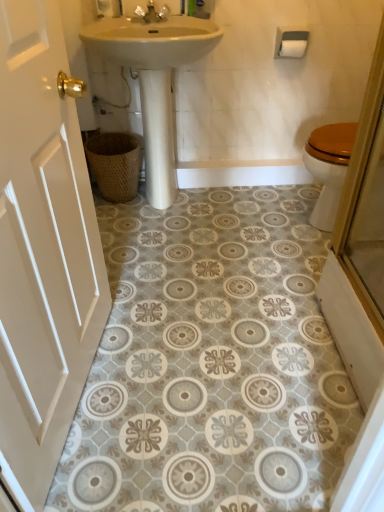
Where is `white painted wood door at left`? The image size is (384, 512). white painted wood door at left is located at coordinates (42, 251).

You are a GUI agent. You are given a task and a screenshot of the screen. Output one action in this format:
    pyautogui.click(x=<x>, y=<y>)
    Task: Click on the woven brown basket at lower left
    
    Given the screenshot: What is the action you would take?
    (114, 164)

What do you see at coordinates (154, 81) in the screenshot? This screenshot has width=384, height=512. I see `white glossy sink at upper center` at bounding box center [154, 81].

Where is `white painted wood door at left`? Image resolution: width=384 pixels, height=512 pixels. white painted wood door at left is located at coordinates point(42,251).

Is white matte toilet paper at upper right oriented away from woven brown basket at lower left?

No, white matte toilet paper at upper right's orientation is not away from woven brown basket at lower left.

Considering the sizes of objects white matte toilet paper at upper right and woven brown basket at lower left in the image provided, who is thinner, white matte toilet paper at upper right or woven brown basket at lower left?

With smaller width is white matte toilet paper at upper right.

At what (x,y) coordinates should I click in order to perform the action: click on basket below the white matte toilet paper at upper right (from a real-world perspective). Please return your answer as a coordinate pair (x, y). This screenshot has width=384, height=512. Looking at the image, I should click on pos(114,164).

From the image's perspective, which one is positioned lower, white matte toilet paper at upper right or woven brown basket at lower left?

woven brown basket at lower left.

In the image, there is a white matte toilet paper at upper right. Identify the location of tap above it (from the image's perspective). (152, 13).

Considering the relative sizes of matte gold faucet at upper center and white matte toilet paper at upper right in the image provided, is matte gold faucet at upper center taller than white matte toilet paper at upper right?

Yes, matte gold faucet at upper center is taller than white matte toilet paper at upper right.

Is matte gold faucet at upper center outside of white matte toilet paper at upper right?

Yes.

In terms of size, does matte gold faucet at upper center appear bigger or smaller than white matte toilet paper at upper right?

Considering their sizes, matte gold faucet at upper center takes up more space than white matte toilet paper at upper right.

Could you tell me if white matte toilet paper at upper right is facing white painted wood door at left?

No.

Does white matte toilet paper at upper right appear on the left side of white painted wood door at left?

No, white matte toilet paper at upper right is not to the left of white painted wood door at left.

The image size is (384, 512). I want to click on door that is under the white matte toilet paper at upper right (from a real-world perspective), so click(42, 251).

Looking at the image, does white matte toilet paper at upper right seem bigger or smaller compared to white painted wood door at left?

white matte toilet paper at upper right is smaller than white painted wood door at left.

From the image's perspective, does white painted wood door at left appear lower than woven brown basket at lower left?

Yes, from the image's perspective, white painted wood door at left is below woven brown basket at lower left.

From a real-world perspective, is white painted wood door at left located beneath woven brown basket at lower left?

No, from a real-world perspective, white painted wood door at left is not beneath woven brown basket at lower left.

Based on the photo, does white painted wood door at left have a larger size compared to woven brown basket at lower left?

Indeed, white painted wood door at left has a larger size compared to woven brown basket at lower left.

Can you tell me how much white painted wood door at left and woven brown basket at lower left differ in facing direction?

There is a 81.9-degree angle between the facing directions of white painted wood door at left and woven brown basket at lower left.

Do you think woven brown basket at lower left is within white painted wood door at left, or outside of it?

woven brown basket at lower left is not inside white painted wood door at left, it's outside.

From a real-world perspective, relative to white painted wood door at left, is woven brown basket at lower left vertically above or below?

woven brown basket at lower left is below white painted wood door at left.

There is a woven brown basket at lower left. Identify the location of door above it (from a real-world perspective). Image resolution: width=384 pixels, height=512 pixels. (42, 251).

Is woven brown basket at lower left to the left or to the right of white painted wood door at left in the image?

Clearly, woven brown basket at lower left is on the left of white painted wood door at left in the image.

From the image's perspective, which object appears higher, woven brown basket at lower left or matte gold faucet at upper center?

matte gold faucet at upper center appears higher in the image.

Considering the sizes of objects woven brown basket at lower left and matte gold faucet at upper center in the image provided, who is smaller, woven brown basket at lower left or matte gold faucet at upper center?

Smaller between the two is matte gold faucet at upper center.

How many degrees apart are the facing directions of woven brown basket at lower left and matte gold faucet at upper center?

The angle between the facing direction of woven brown basket at lower left and the facing direction of matte gold faucet at upper center is 0.00149 degrees.

The width and height of the screenshot is (384, 512). Find the location of `basket that is below the matte gold faucet at upper center (from the image's perspective)`. basket that is below the matte gold faucet at upper center (from the image's perspective) is located at coordinates pos(114,164).

Is point (138, 174) farther from camera compared to point (291, 56)?

Yes, it is behind point (291, 56).

Looking at this image, which object is wider, woven brown basket at lower left or white matte toilet paper at upper right?

woven brown basket at lower left.

Is woven brown basket at lower left to the left of white matte toilet paper at upper right from the viewer's perspective?

Indeed, woven brown basket at lower left is positioned on the left side of white matte toilet paper at upper right.

From a real-world perspective, which is physically above, woven brown basket at lower left or white matte toilet paper at upper right?

white matte toilet paper at upper right, from a real-world perspective.

Locate an element on the screen. This screenshot has width=384, height=512. basket behind the white matte toilet paper at upper right is located at coordinates (114, 164).

This screenshot has width=384, height=512. I want to click on toilet paper that appears below the matte gold faucet at upper center (from a real-world perspective), so click(x=292, y=48).

Based on their spatial positions, is white glossy sink at upper center or white painted wood door at left further from woven brown basket at lower left?

white painted wood door at left is positioned further to the anchor woven brown basket at lower left.

Based on their spatial positions, is white painted wood door at left or woven brown basket at lower left further from white matte toilet paper at upper right?

Based on the image, white painted wood door at left appears to be further to white matte toilet paper at upper right.

When comparing their distances from woven brown basket at lower left, does matte gold faucet at upper center or white matte toilet paper at upper right seem closer?

The object closer to woven brown basket at lower left is matte gold faucet at upper center.

From the image, which object appears to be farther from white painted wood door at left, matte gold faucet at upper center or woven brown basket at lower left?

Based on the image, matte gold faucet at upper center appears to be further to white painted wood door at left.

Estimate the real-world distances between objects in this image. Which object is closer to woven brown basket at lower left, white glossy sink at upper center or matte gold faucet at upper center?

white glossy sink at upper center lies closer to woven brown basket at lower left than the other object.

When comparing their distances from white painted wood door at left, does white matte toilet paper at upper right or white glossy sink at upper center seem closer?

white glossy sink at upper center is closer to white painted wood door at left.

Based on their spatial positions, is white painted wood door at left or matte gold faucet at upper center closer to woven brown basket at lower left?

matte gold faucet at upper center lies closer to woven brown basket at lower left than the other object.

When comparing their distances from woven brown basket at lower left, does white matte toilet paper at upper right or white painted wood door at left seem closer?

white matte toilet paper at upper right lies closer to woven brown basket at lower left than the other object.

Locate an element on the screen. sink between matte gold faucet at upper center and woven brown basket at lower left vertically is located at coordinates (154, 81).

The width and height of the screenshot is (384, 512). Find the location of `tap situated between woven brown basket at lower left and white matte toilet paper at upper right from left to right`. tap situated between woven brown basket at lower left and white matte toilet paper at upper right from left to right is located at coordinates (152, 13).

Find the location of `sink situated between woven brown basket at lower left and white matte toilet paper at upper right from left to right`. sink situated between woven brown basket at lower left and white matte toilet paper at upper right from left to right is located at coordinates (154, 81).

This screenshot has width=384, height=512. Identify the location of tap between white painted wood door at left and woven brown basket at lower left along the z-axis. (152, 13).